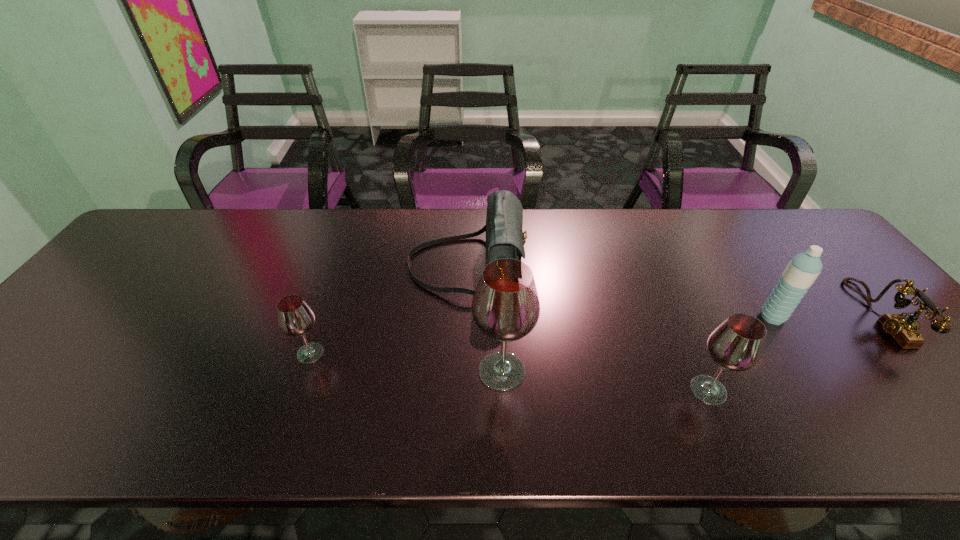
Locate an element on the screen. The image size is (960, 540). the fifth tallest object is located at coordinates (x=295, y=318).

Where is `the leftmost object`? the leftmost object is located at coordinates coord(295,318).

At what (x,y) coordinates should I click in order to perform the action: click on the tallest wineglass. Please return your answer as a coordinate pair (x, y). The height and width of the screenshot is (540, 960). Looking at the image, I should click on (505, 307).

You are a GUI agent. You are given a task and a screenshot of the screen. Output one action in this format:
    pyautogui.click(x=<x>, y=<y>)
    Task: Click on the tallest object
    The width and height of the screenshot is (960, 540).
    Given the screenshot: What is the action you would take?
    pyautogui.click(x=505, y=307)

Where is `the rightmost wineglass`? This screenshot has width=960, height=540. the rightmost wineglass is located at coordinates (737, 344).

Locate an element on the screen. This screenshot has width=960, height=540. the fourth object from left to right is located at coordinates (737, 344).

This screenshot has width=960, height=540. What are the coordinates of `the second object from right to left` in the screenshot? It's located at tap(803, 269).

This screenshot has width=960, height=540. I want to click on shoulder bag, so click(505, 238).

The width and height of the screenshot is (960, 540). Find the location of `the shortest object`. the shortest object is located at coordinates (904, 330).

Where is `telephone`? telephone is located at coordinates (904, 330).